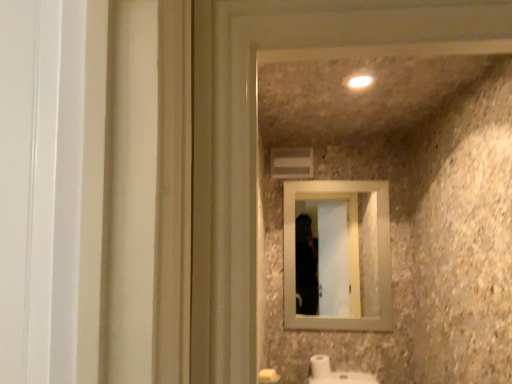
Question: Considering the relative sizes of beige wood mirror at center and white glossy light at upper center in the image provided, is beige wood mirror at center thinner than white glossy light at upper center?

Choices:
 (A) no
 (B) yes

Answer: (B)

Question: Is beige wood mirror at center looking in the opposite direction of white glossy light at upper center?

Choices:
 (A) no
 (B) yes

Answer: (A)

Question: Is white glossy light at upper center located within beige wood mirror at center?

Choices:
 (A) no
 (B) yes

Answer: (A)

Question: Does beige wood mirror at center have a smaller size compared to white glossy light at upper center?

Choices:
 (A) yes
 (B) no

Answer: (B)

Question: Does beige wood mirror at center have a greater width compared to white glossy light at upper center?

Choices:
 (A) no
 (B) yes

Answer: (A)

Question: From a real-world perspective, is white glossy light at upper center physically located above or below beige wood mirror at center?

Choices:
 (A) below
 (B) above

Answer: (B)

Question: Does point (349, 84) appear closer or farther from the camera than point (374, 259)?

Choices:
 (A) farther
 (B) closer

Answer: (B)

Question: Is white glossy light at upper center inside or outside of beige wood mirror at center?

Choices:
 (A) inside
 (B) outside

Answer: (B)

Question: Considering their positions, is white glossy light at upper center located in front of or behind beige wood mirror at center?

Choices:
 (A) front
 (B) behind

Answer: (A)

Question: Is white matte toilet paper at lower center spatially inside white glossy light at upper center, or outside of it?

Choices:
 (A) outside
 (B) inside

Answer: (A)

Question: Considering the positions of white matte toilet paper at lower center and white glossy light at upper center in the image, is white matte toilet paper at lower center wider or thinner than white glossy light at upper center?

Choices:
 (A) thin
 (B) wide

Answer: (B)

Question: Visually, is white matte toilet paper at lower center positioned to the left or to the right of white glossy light at upper center?

Choices:
 (A) left
 (B) right

Answer: (A)

Question: Is white matte toilet paper at lower center bigger or smaller than white glossy light at upper center?

Choices:
 (A) small
 (B) big

Answer: (B)

Question: Considering their positions, is beige wood mirror at center located in front of or behind white glossy light at upper center?

Choices:
 (A) behind
 (B) front

Answer: (A)

Question: Is beige wood mirror at center situated inside white glossy light at upper center or outside?

Choices:
 (A) inside
 (B) outside

Answer: (B)